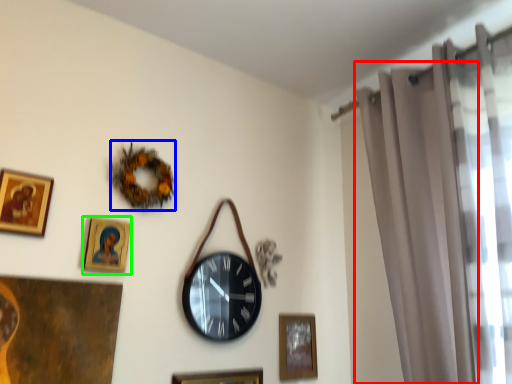
Question: Considering the real-world distances, which object is farthest from curtain (highlighted by a red box)? decor (highlighted by a blue box) or picture frame (highlighted by a green box)?

Choices:
 (A) decor
 (B) picture frame

Answer: (B)